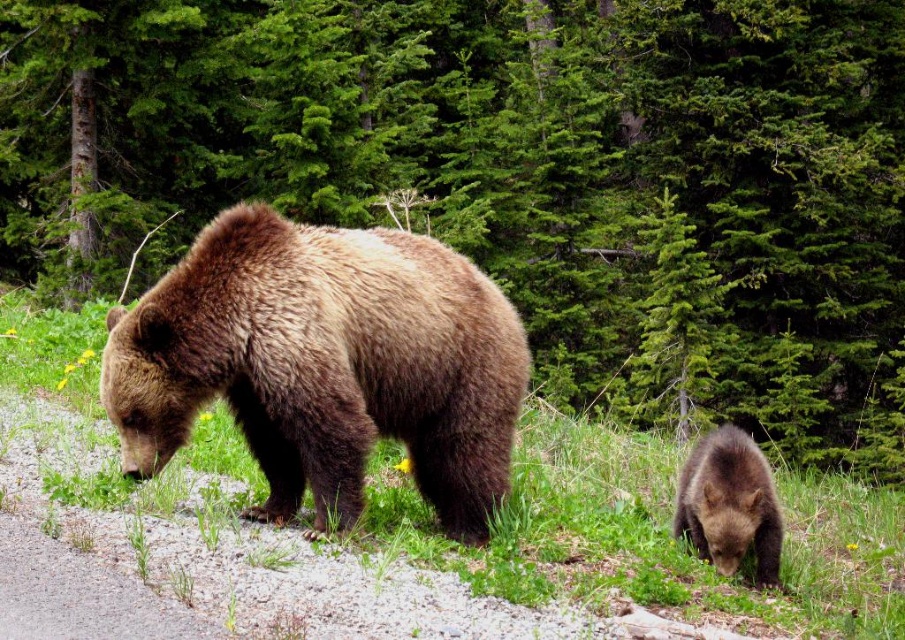
Question: Which of these objects is positioned closest to the green soft grass at center?

Choices:
 (A) brown furry bear at center
 (B) brown furry bear at lower right

Answer: (A)

Question: Is brown furry bear at center smaller than green soft grass at center?

Choices:
 (A) no
 (B) yes

Answer: (B)

Question: Which point is farther to the camera?

Choices:
 (A) green soft grass at center
 (B) brown furry bear at lower right

Answer: (B)

Question: Is green soft grass at center to the right of brown furry bear at lower right from the viewer's perspective?

Choices:
 (A) no
 (B) yes

Answer: (A)

Question: Which point appears farthest from the camera in this image?

Choices:
 (A) (488, 438)
 (B) (745, 477)

Answer: (B)

Question: Is brown furry bear at center bigger than brown furry bear at lower right?

Choices:
 (A) yes
 (B) no

Answer: (A)